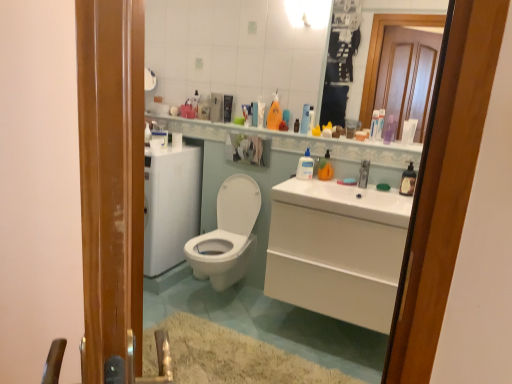
Locate an element on the screen. The height and width of the screenshot is (384, 512). vacant area that lies to the right of white glossy sink at upper center, arranged as the 2th sink when viewed from the left is located at coordinates (385, 192).